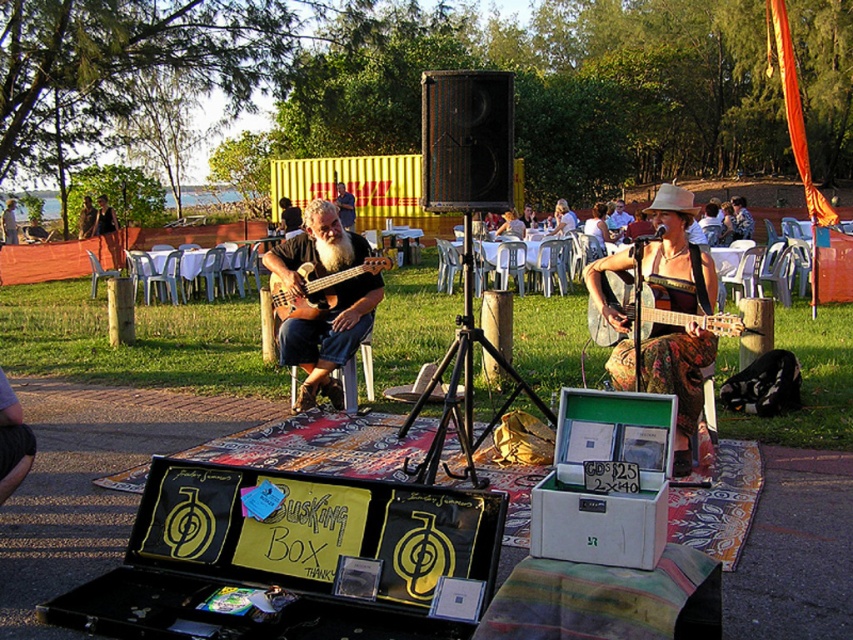
Can you confirm if brown wood guitar at center is positioned to the left of wooden acoustic guitar at center?

Indeed, brown wood guitar at center is positioned on the left side of wooden acoustic guitar at center.

Which is more to the right, brown wood guitar at center or wooden acoustic guitar at center?

wooden acoustic guitar at center is more to the right.

Which is in front, point (296, 314) or point (698, 326)?

Positioned in front is point (698, 326).

The width and height of the screenshot is (853, 640). I want to click on brown wood guitar at center, so 317,288.

Between point (701, 260) and point (704, 314), which one is positioned in front?

Point (704, 314) is in front.

Describe the element at coordinates (668, 376) in the screenshot. Image resolution: width=853 pixels, height=640 pixels. I see `floral fabric guitar at center` at that location.

Between point (664, 294) and point (686, 314), which one is positioned behind?

The point (664, 294) is more distant.

This screenshot has height=640, width=853. Identify the location of floral fabric guitar at center. (668, 376).

Does floral fabric guitar at center lie behind matte brown guitar at center?

No, floral fabric guitar at center is closer to the viewer.

Is floral fabric guitar at center taller than matte brown guitar at center?

Indeed, floral fabric guitar at center has a greater height compared to matte brown guitar at center.

The image size is (853, 640). In order to click on floral fabric guitar at center in this screenshot , I will do `click(668, 376)`.